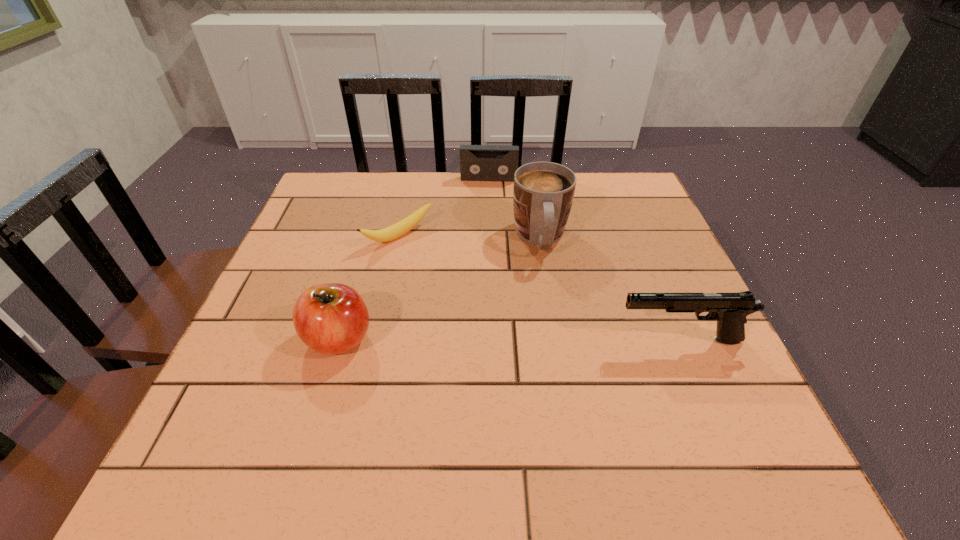
Find the location of a particular element. vacant point located between the videotape and the apple is located at coordinates (414, 259).

This screenshot has width=960, height=540. Find the location of `the second closest object to the banana`. the second closest object to the banana is located at coordinates (477, 162).

What are the coordinates of `object that is the nearest to the apple` in the screenshot? It's located at (390, 233).

Where is `vacant space that satisfies the following two spatial constraints: 1. on the front side of the farthest object; 2. at the aiming end of the gun`? vacant space that satisfies the following two spatial constraints: 1. on the front side of the farthest object; 2. at the aiming end of the gun is located at coordinates (493, 340).

Image resolution: width=960 pixels, height=540 pixels. I want to click on vacant area that satisfies the following two spatial constraints: 1. on the front side of the mug; 2. on the right side of the banana, so pyautogui.click(x=398, y=239).

The height and width of the screenshot is (540, 960). Identify the location of vacant space that satisfies the following two spatial constraints: 1. on the back side of the second shortest object; 2. on the right side of the apple. (387, 179).

At what (x,y) coordinates should I click in order to perform the action: click on vacant area in the image that satisfies the following two spatial constraints: 1. on the front side of the apple; 2. at the aiming end of the gun. Please return your answer as a coordinate pair (x, y). Image resolution: width=960 pixels, height=540 pixels. Looking at the image, I should click on (339, 340).

Image resolution: width=960 pixels, height=540 pixels. Identify the location of vacant space that satisfies the following two spatial constraints: 1. on the front side of the gun; 2. at the aiming end of the apple. (339, 340).